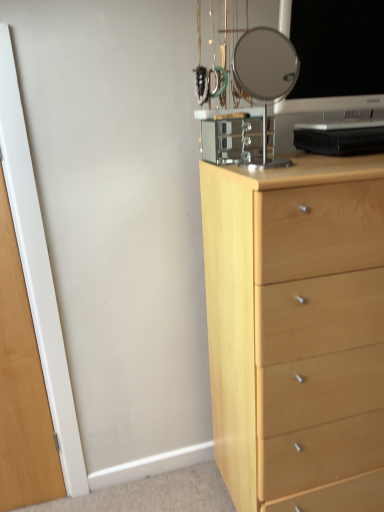
In order to click on free point to the right of clear glass mirror at upper center in this screenshot , I will do `click(325, 162)`.